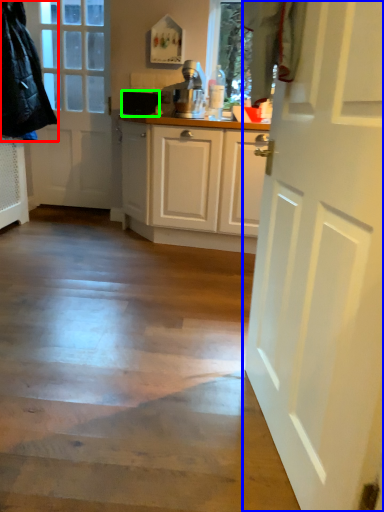
Question: Estimate the real-world distances between objects in this image. Which object is closer to jacket (highlighted by a red box), door (highlighted by a blue box) or appliance (highlighted by a green box)?

Choices:
 (A) door
 (B) appliance

Answer: (B)